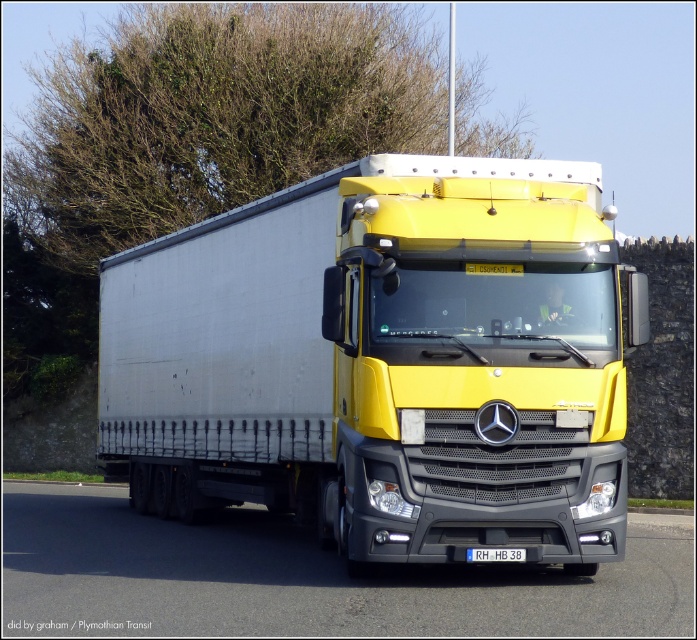
Measure the distance between white matte trailer at center and green leafy tree at upper center.

13.22 meters

Between point (155, 308) and point (91, 243), which one is positioned behind?

The point (91, 243) is more distant.

Locate an element on the screen. Image resolution: width=697 pixels, height=640 pixels. white matte trailer at center is located at coordinates (383, 362).

Can you confirm if green leafy tree at upper center is thinner than black rubber highway at center?

No, green leafy tree at upper center is not thinner than black rubber highway at center.

Does point (279, 140) lie in front of point (558, 595)?

No.

In order to click on green leafy tree at upper center in this screenshot , I will do `click(213, 115)`.

In the scene shown: Does black rubber highway at center have a larger size compared to white plastic license plate at center?

Yes, black rubber highway at center is bigger than white plastic license plate at center.

Can you confirm if black rubber highway at center is positioned above white plastic license plate at center?

No, black rubber highway at center is not above white plastic license plate at center.

What do you see at coordinates (302, 579) in the screenshot? I see `black rubber highway at center` at bounding box center [302, 579].

Locate an element on the screen. black rubber highway at center is located at coordinates (302, 579).